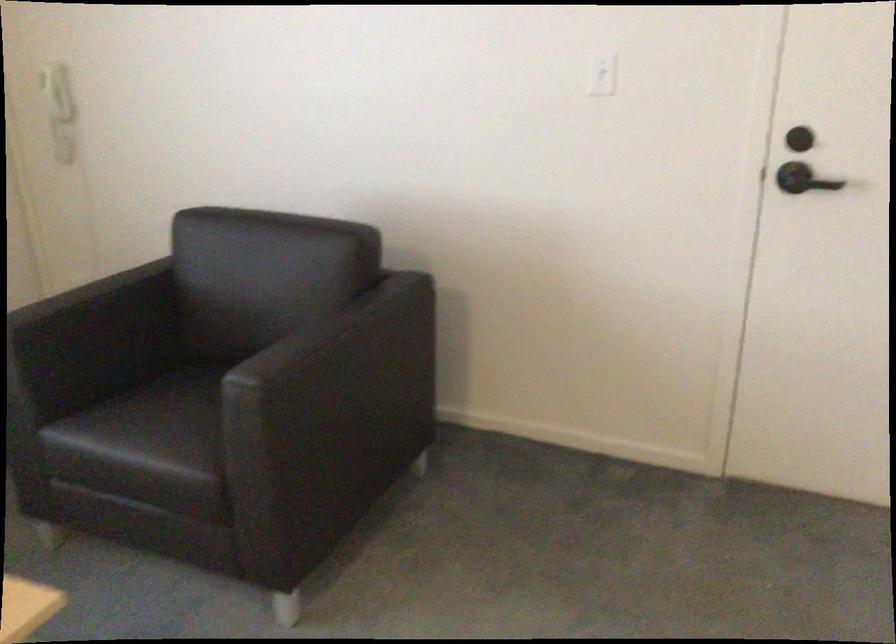
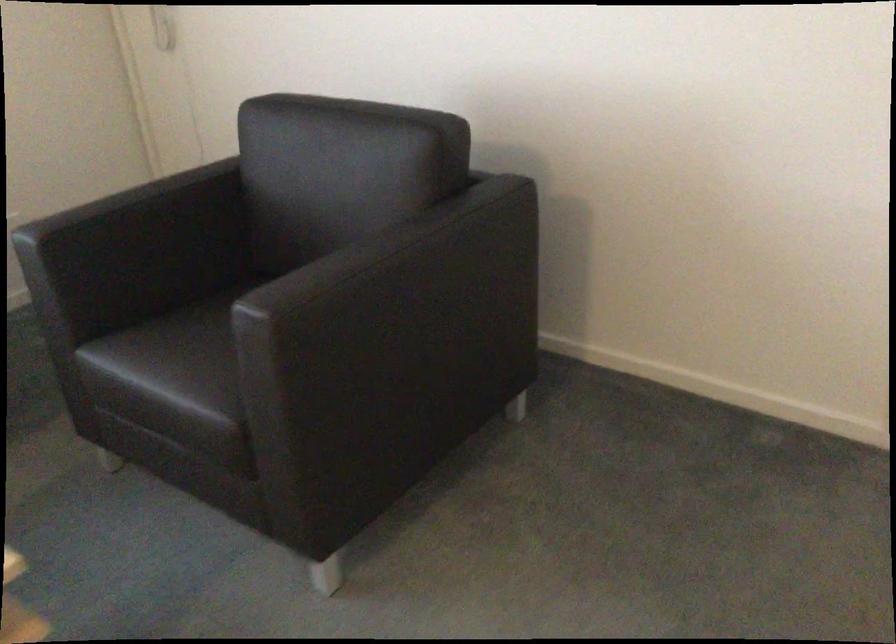
The point at [99,317] is marked in the first image. Where is the corresponding point in the second image?

(147, 225)